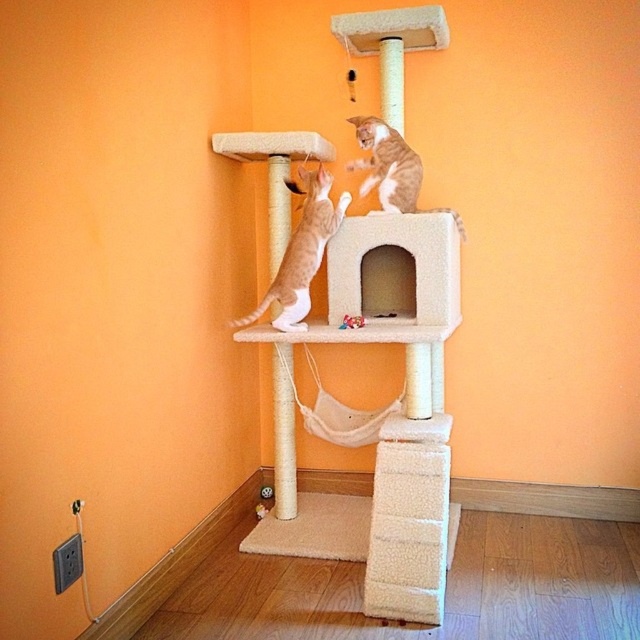
Question: Which point appears closest to the camera in this image?

Choices:
 (A) (330, 202)
 (B) (412, 179)

Answer: (A)

Question: Is orange fur cat at center above orange fur cat at upper center?

Choices:
 (A) yes
 (B) no

Answer: (B)

Question: Which object appears closest to the camera in this image?

Choices:
 (A) orange fur cat at center
 (B) orange fur cat at upper center

Answer: (A)

Question: Which of the following is the farthest from the observer?

Choices:
 (A) orange fur cat at upper center
 (B) orange fur cat at center

Answer: (A)

Question: Can you confirm if orange fur cat at center is positioned below orange fur cat at upper center?

Choices:
 (A) yes
 (B) no

Answer: (A)

Question: Is orange fur cat at center below orange fur cat at upper center?

Choices:
 (A) no
 (B) yes

Answer: (B)